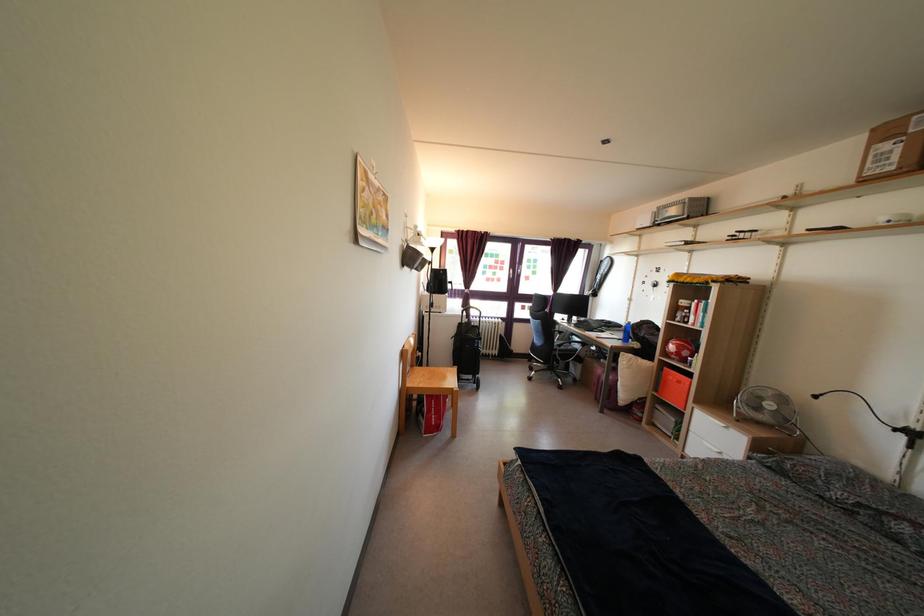
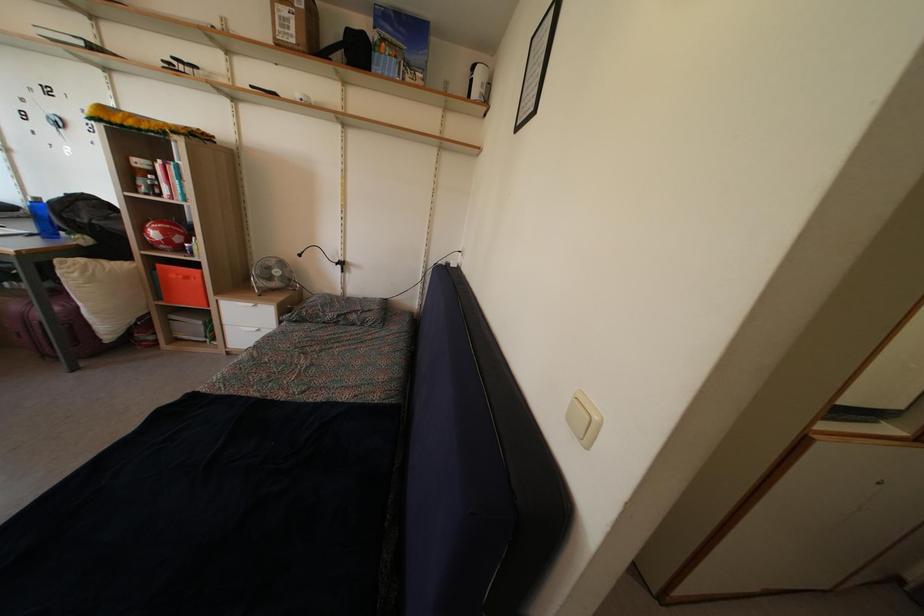
In the second image, find the point that corresponds to pixel 895 177 in the first image.

(296, 50)